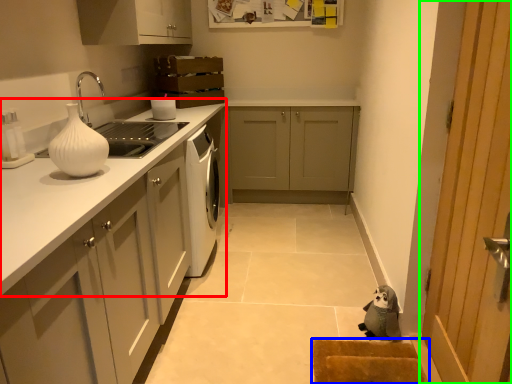
Question: Which object is the farthest from countertop (highlighted by a red box)? Choose among these: doormat (highlighted by a blue box) or door (highlighted by a green box).

Choices:
 (A) doormat
 (B) door

Answer: (B)